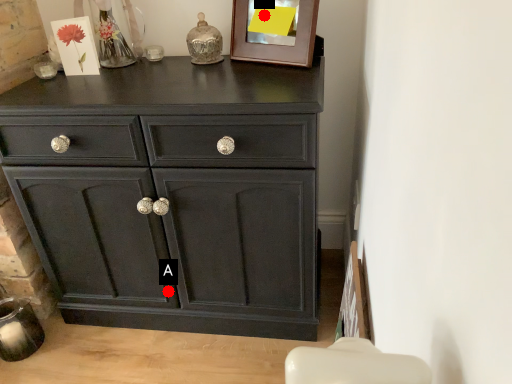
Question: Two points are circled on the image, labeled by A and B beside each circle. Which of the following is the closest to the observer?

Choices:
 (A) A is closer
 (B) B is closer

Answer: (B)